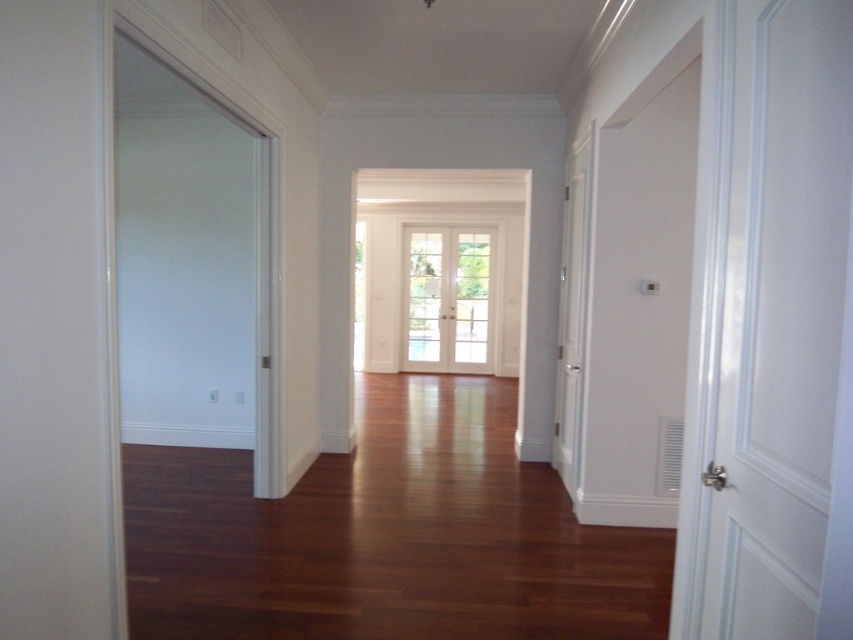
Who is positioned more to the left, white matte door at right or clear glass door at center?

clear glass door at center is more to the left.

Locate an element on the screen. white matte door at right is located at coordinates (766, 317).

Locate an element on the screen. The width and height of the screenshot is (853, 640). white matte door at right is located at coordinates (766, 317).

Is white glossy door at upper right bigger than clear glass door at center?

Correct, white glossy door at upper right is larger in size than clear glass door at center.

Can you confirm if white glossy door at upper right is positioned above clear glass door at center?

No.

The height and width of the screenshot is (640, 853). What do you see at coordinates (637, 308) in the screenshot?
I see `white glossy door at upper right` at bounding box center [637, 308].

Identify the location of white glossy door at upper right. 637,308.

Does white matte door at right appear over white glossy door at upper right?

Indeed, white matte door at right is positioned over white glossy door at upper right.

Is white matte door at right wider than white glossy door at upper right?

Incorrect, white matte door at right's width does not surpass white glossy door at upper right's.

This screenshot has height=640, width=853. Identify the location of white matte door at right. (766, 317).